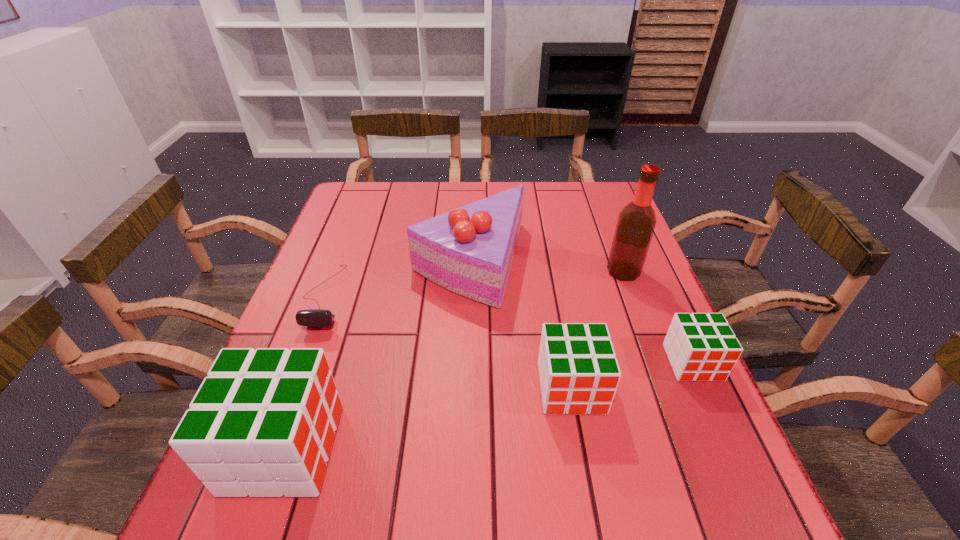
Image resolution: width=960 pixels, height=540 pixels. Find the location of `vacant space located on the red face of the second shortest object`. vacant space located on the red face of the second shortest object is located at coordinates (720, 421).

Where is `free region located on the left of the cake`? The width and height of the screenshot is (960, 540). free region located on the left of the cake is located at coordinates pyautogui.click(x=332, y=262).

Find the location of `free space located on the left of the beer bottle`. free space located on the left of the beer bottle is located at coordinates (x=456, y=272).

I want to click on vacant point located 0.110m on the front-facing side of the shortest object, so click(297, 372).

The height and width of the screenshot is (540, 960). What are the coordinates of `object that is at the near edge` in the screenshot? It's located at (263, 422).

Locate an element on the screen. The height and width of the screenshot is (540, 960). cube at the left edge is located at coordinates (263, 422).

At what (x,y) coordinates should I click in order to perform the action: click on webcam that is at the left edge. Please return your answer as a coordinate pair (x, y). Looking at the image, I should click on click(x=312, y=317).

I want to click on cube located at the right edge, so click(x=702, y=347).

The height and width of the screenshot is (540, 960). Identify the location of beer bottle that is positioned at the right edge. (636, 222).

Where is `object at the near left corner`? Image resolution: width=960 pixels, height=540 pixels. object at the near left corner is located at coordinates (263, 422).